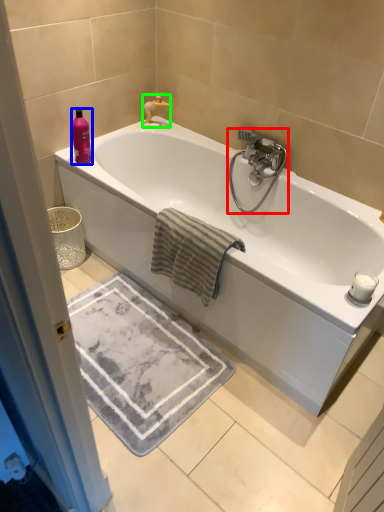
Question: Estimate the real-world distances between objects in this image. Which object is farther from tap (highlighted by a red box), toiletry (highlighted by a blue box) or faucet (highlighted by a green box)?

Choices:
 (A) toiletry
 (B) faucet

Answer: (A)